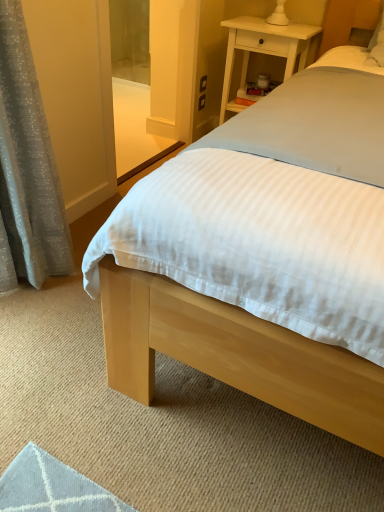
Question: Would you say gray textured curtain at left is to the left or to the right of light wood bed at center in the picture?

Choices:
 (A) right
 (B) left

Answer: (B)

Question: In terms of size, does gray textured curtain at left appear bigger or smaller than light wood bed at center?

Choices:
 (A) small
 (B) big

Answer: (A)

Question: Which is nearer to the light wood bed at center?

Choices:
 (A) gray textured curtain at left
 (B) transparent glass screen door at upper center
 (C) white wood nightstand at upper right

Answer: (C)

Question: Estimate the real-world distances between objects in this image. Which object is closer to the gray textured curtain at left?

Choices:
 (A) white wood nightstand at upper right
 (B) transparent glass screen door at upper center
 (C) light wood bed at center

Answer: (B)